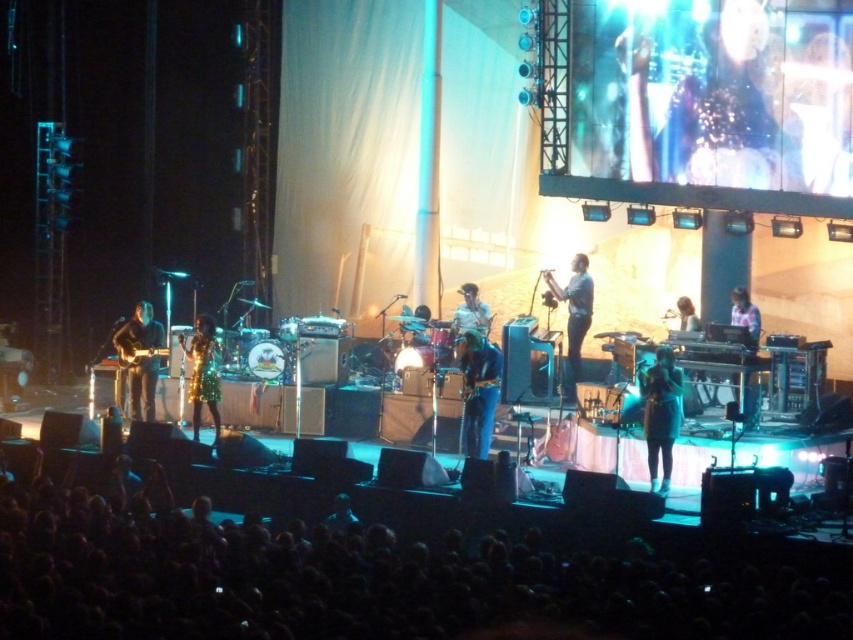
Which of these two, black fabric crowd at lower center or shiny metallic guitar at left, stands shorter?

black fabric crowd at lower center

What do you see at coordinates (358, 579) in the screenshot? This screenshot has height=640, width=853. I see `black fabric crowd at lower center` at bounding box center [358, 579].

In order to click on black fabric crowd at lower center in this screenshot , I will do `click(358, 579)`.

Looking at this image, between shiny blue jeans at center and light blue denim shirt at center, which one appears on the left side from the viewer's perspective?

Positioned to the left is shiny blue jeans at center.

In the scene shown: Is shiny blue jeans at center bigger than light blue denim shirt at center?

Correct, shiny blue jeans at center is larger in size than light blue denim shirt at center.

What do you see at coordinates (479, 388) in the screenshot? I see `shiny blue jeans at center` at bounding box center [479, 388].

Image resolution: width=853 pixels, height=640 pixels. What are the coordinates of `shiny blue jeans at center` in the screenshot? It's located at (479, 388).

Is matte brown guitar at left bigger than shiny metallic guitar at left?

Indeed, matte brown guitar at left has a larger size compared to shiny metallic guitar at left.

Between matte brown guitar at left and shiny metallic guitar at left, which one has less height?

With less height is shiny metallic guitar at left.

Between point (148, 337) and point (136, 349), which one is positioned in front?

Point (136, 349) is in front.

This screenshot has width=853, height=640. I want to click on matte brown guitar at left, so click(140, 356).